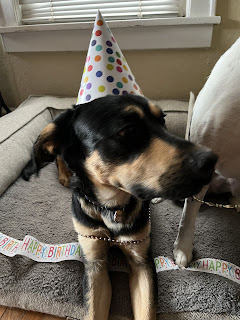
Where is `window sill`? The image size is (240, 320). window sill is located at coordinates (147, 38), (141, 25).